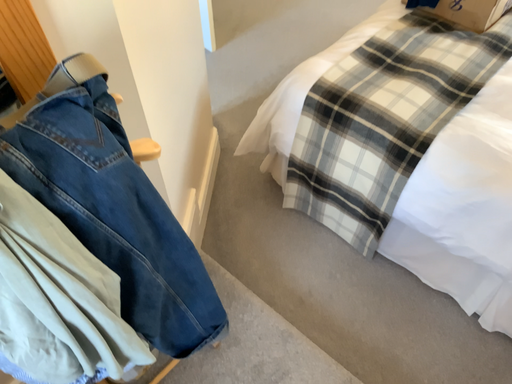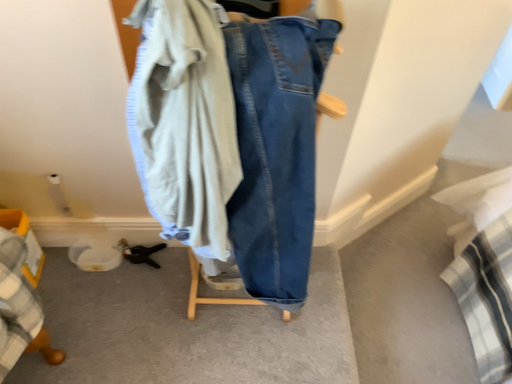
Question: Which way did the camera rotate in the video?

Choices:
 (A) rotated left
 (B) rotated right

Answer: (A)